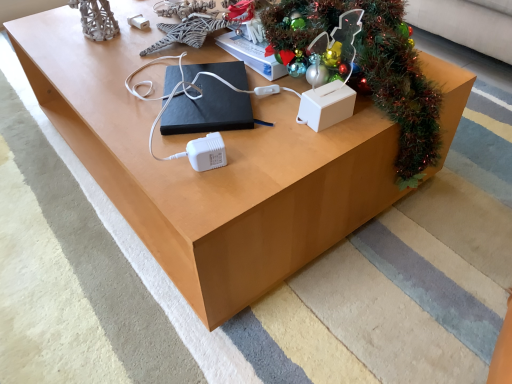
Question: Are black matte book at center and green shiny garland at upper right making contact?

Choices:
 (A) yes
 (B) no

Answer: (B)

Question: Is the depth of black matte book at center less than that of green shiny garland at upper right?

Choices:
 (A) yes
 (B) no

Answer: (B)

Question: Does black matte book at center have a smaller size compared to green shiny garland at upper right?

Choices:
 (A) no
 (B) yes

Answer: (B)

Question: Are black matte book at center and green shiny garland at upper right located far from each other?

Choices:
 (A) no
 (B) yes

Answer: (A)

Question: Is black matte book at center outside green shiny garland at upper right?

Choices:
 (A) yes
 (B) no

Answer: (A)

Question: Is black matte book at center turned away from green shiny garland at upper right?

Choices:
 (A) no
 (B) yes

Answer: (A)

Question: Is green shiny garland at upper right a part of white plastic tissue box at center-right?

Choices:
 (A) no
 (B) yes

Answer: (A)

Question: Can you confirm if white plastic tissue box at center-right is bigger than green shiny garland at upper right?

Choices:
 (A) yes
 (B) no

Answer: (B)

Question: Is the position of white plastic tissue box at center-right less distant than that of green shiny garland at upper right?

Choices:
 (A) yes
 (B) no

Answer: (B)

Question: Does white plastic tissue box at center-right have a smaller size compared to green shiny garland at upper right?

Choices:
 (A) yes
 (B) no

Answer: (A)

Question: Considering the relative sizes of white plastic tissue box at center-right and green shiny garland at upper right in the image provided, is white plastic tissue box at center-right wider than green shiny garland at upper right?

Choices:
 (A) yes
 (B) no

Answer: (B)

Question: Is white plastic tissue box at center-right facing away from green shiny garland at upper right?

Choices:
 (A) no
 (B) yes

Answer: (B)

Question: Is black matte book at center wider than white plastic tissue box at center-right?

Choices:
 (A) no
 (B) yes

Answer: (B)